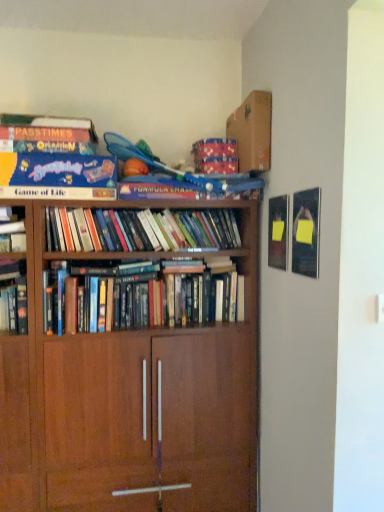
Question: Is hardcover books at center, placed as the 1th book when sorted from bottom to top, outside cardboard at upper center?

Choices:
 (A) no
 (B) yes

Answer: (B)

Question: Are hardcover books at center, placed as the 1th book when sorted from bottom to top, and cardboard at upper center far apart?

Choices:
 (A) yes
 (B) no

Answer: (B)

Question: Is hardcover books at center, placed as the 1th book when sorted from bottom to top, wider than cardboard at upper center?

Choices:
 (A) yes
 (B) no

Answer: (B)

Question: From the image's perspective, is hardcover books at center, placed as the 1th book when sorted from bottom to top, on cardboard at upper center?

Choices:
 (A) no
 (B) yes

Answer: (A)

Question: Considering the relative positions of hardcover books at center, the 3th book in the top-to-bottom sequence, and cardboard at upper center in the image provided, is hardcover books at center, the 3th book in the top-to-bottom sequence, to the left of cardboard at upper center from the viewer's perspective?

Choices:
 (A) yes
 (B) no

Answer: (A)

Question: Does hardcover books at center, the 3th book in the top-to-bottom sequence, have a greater height compared to cardboard at upper center?

Choices:
 (A) yes
 (B) no

Answer: (B)

Question: Is there a large distance between hardcover books at center, placed as the 1th book when sorted from bottom to top, and blue cardboard game of life at upper left, placed as the first book when sorted from top to bottom?

Choices:
 (A) no
 (B) yes

Answer: (A)

Question: Is hardcover books at center, the 3th book in the top-to-bottom sequence, smaller than blue cardboard game of life at upper left, placed as the first book when sorted from top to bottom?

Choices:
 (A) no
 (B) yes

Answer: (A)

Question: Considering the relative sizes of hardcover books at center, placed as the 1th book when sorted from bottom to top, and blue cardboard game of life at upper left, placed as the first book when sorted from top to bottom, in the image provided, is hardcover books at center, placed as the 1th book when sorted from bottom to top, taller than blue cardboard game of life at upper left, placed as the first book when sorted from top to bottom,?

Choices:
 (A) no
 (B) yes

Answer: (A)

Question: Is hardcover books at center, placed as the 1th book when sorted from bottom to top, not within blue cardboard game of life at upper left, placed as the first book when sorted from top to bottom?

Choices:
 (A) yes
 (B) no

Answer: (A)

Question: Does hardcover books at center, placed as the 1th book when sorted from bottom to top, turn towards blue cardboard game of life at upper left, placed as the first book when sorted from top to bottom?

Choices:
 (A) yes
 (B) no

Answer: (B)

Question: Is hardcover books at center, placed as the 1th book when sorted from bottom to top, behind blue cardboard game of life at upper left, arranged as the third book when ordered from the bottom?

Choices:
 (A) no
 (B) yes

Answer: (B)

Question: Can you confirm if hardcover books at center, acting as the 2th book starting from the bottom, is positioned to the left of blue cardboard game of life at upper left, placed as the first book when sorted from top to bottom?

Choices:
 (A) no
 (B) yes

Answer: (A)